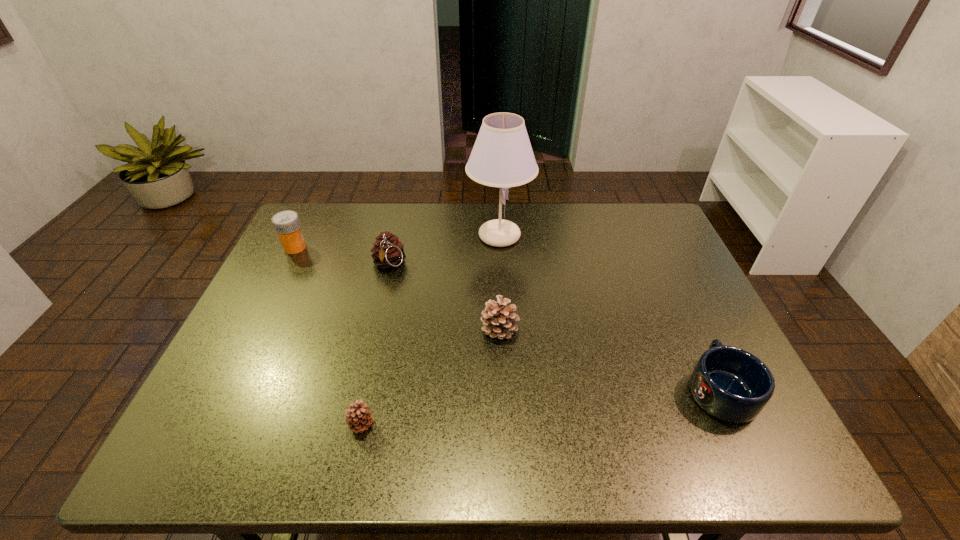
You are a GUI agent. You are given a task and a screenshot of the screen. Output one action in this format:
    pyautogui.click(x=<x>, y=<y>)
    Task: Click on the object located in the right edge section of the desktop
    The width and height of the screenshot is (960, 540).
    Given the screenshot: What is the action you would take?
    pyautogui.click(x=731, y=384)

Find the location of a particular element. This screenshot has width=960, height=540. object present at the far left corner is located at coordinates (286, 223).

Where is `object located at the near right corner`? object located at the near right corner is located at coordinates (731, 384).

At what (x,y) coordinates should I click in order to perform the action: click on free location at the far edge of the desktop. Please return your answer as a coordinate pair (x, y). The image size is (960, 540). Looking at the image, I should click on coord(476,236).

You are a GUI agent. You are given a task and a screenshot of the screen. Output one action in this format:
    pyautogui.click(x=<x>, y=<y>)
    Task: Click on the vacant point at the near edge
    This screenshot has height=540, width=960.
    Given the screenshot: What is the action you would take?
    pyautogui.click(x=319, y=466)

In the image, there is a desktop. Where is `free region at the left edge`? The width and height of the screenshot is (960, 540). free region at the left edge is located at coordinates (288, 357).

Where is `vacant region at the right edge`? The image size is (960, 540). vacant region at the right edge is located at coordinates (684, 297).

In the image, there is a desktop. At what (x,y) coordinates should I click in order to perform the action: click on vacant space at the far right corner. Please return your answer as a coordinate pair (x, y). The image size is (960, 540). Looking at the image, I should click on (636, 237).

In order to click on vacant area between the second nearest pinecone and the tallest object in this screenshot , I will do `click(500, 282)`.

The height and width of the screenshot is (540, 960). Find the location of `vacant region between the shortest pinecone and the second farthest pinecone`. vacant region between the shortest pinecone and the second farthest pinecone is located at coordinates (430, 377).